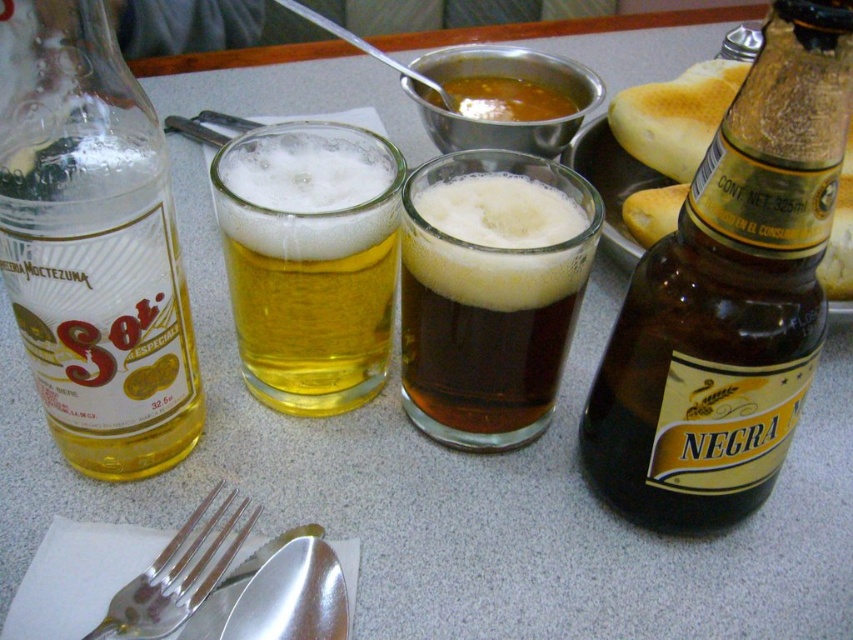
From the picture: You are setting up a table for a party and need to arrange the brown glass bottle at upper right and the golden glass beer at center. Which of the two has a smaller diameter?

The brown glass bottle at upper right has a smaller diameter than the golden glass beer at center because it is thinner.

You are standing 10 inches away from the table. The brown glass bottle at upper right is on the table. Can you reach it without moving your feet?

The brown glass bottle at upper right is 7.86 inches away from the camera, so if you are standing 10 inches away from the table, you can reach it without moving your feet since it is within arm reach.

You are a photographer standing at the camera position. You want to focus on both point (195, 557) and point (329, 556) in the image. Which point is closer to your camera?

Point (195, 557) is further to the camera than point (329, 556). Wait, no, the description says the first point is further, so the second point is closer. Hmm, need to clarify. The answer should state that point (195, 557) is further away from the camera than point (329, 556), so the closer one is the latter. Let me rephrase. The answer should be that point (329, 556) is closer because the first point is further. Wait, the description says point A is further than point B, so point B is closer. So,